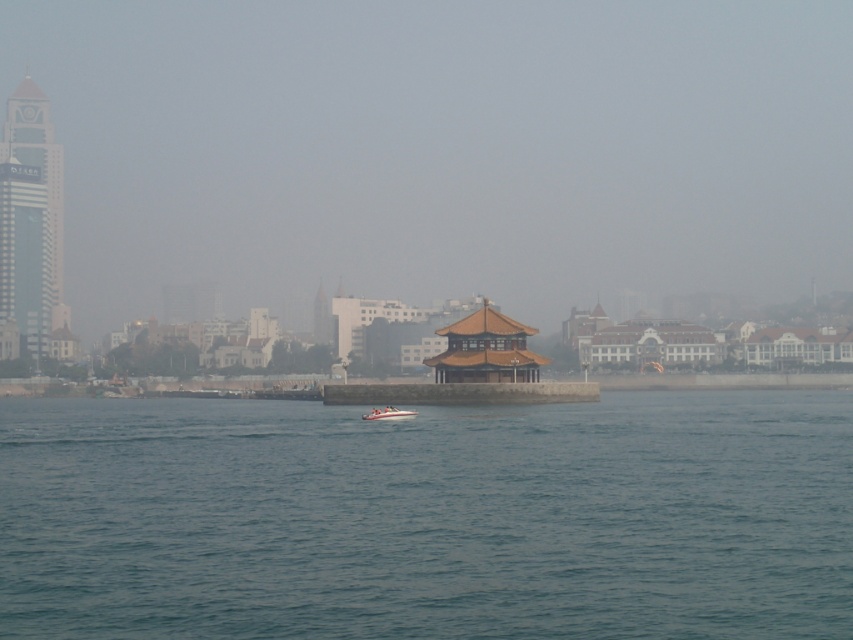
You are a photographer planning to capture the white glossy speedboat at center and the clear blue water at center in a single shot. Based on the scene, which object occupies more horizontal space in the image?

The clear blue water at center is wider than the white glossy speedboat at center, so it occupies more horizontal space in the image.

You are a delivery drone that needs to fly from the gray glass skyscraper at left to the white glossy speedboat at center. The maximum flight distance of your drone is 600 feet. Can you reach the destination without recharging?

The gray glass skyscraper at left is 652.19 feet from the white glossy speedboat at center, which exceeds the drone maximum flight distance of 600 feet. Therefore, the drone cannot reach the destination without recharging.

You are a photographer planning to capture the waterfront scene. You want to ensure that both the gray glass skyscraper at left and the white glossy speedboat at center are clearly visible in your shot. Given their sizes, which object should you prioritize framing closer to the edge of the frame to avoid overcrowding the composition?

The gray glass skyscraper at left is wider than the white glossy speedboat at center, so you should prioritize framing the gray glass skyscraper at left closer to the edge of the frame to avoid overcrowding the composition.